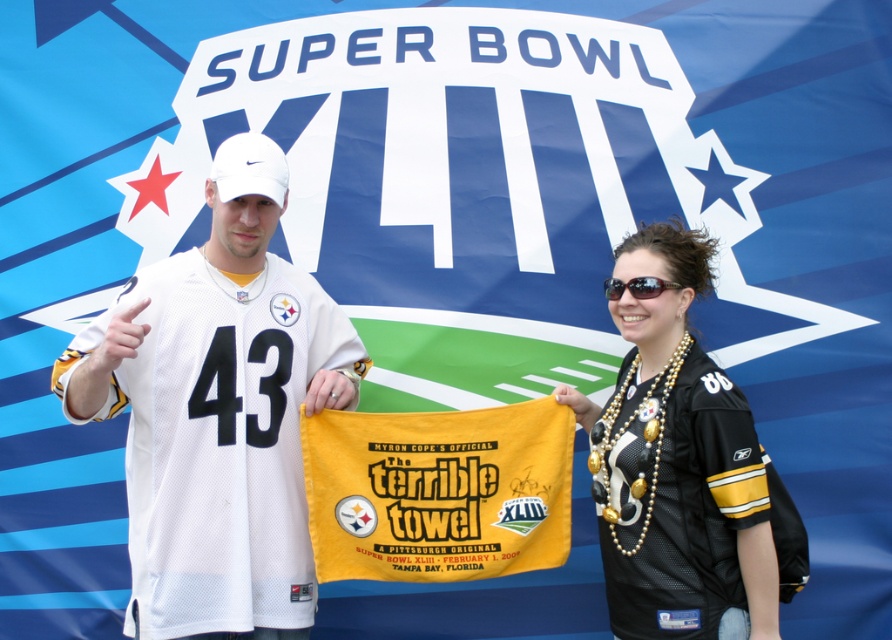
You are standing in front of the Super Bowl XLIII backdrop and see the white jersey at center and the black jersey at center. If you want to place a 3.5 feet wide banner between them, will there be enough space?

The white jersey at center is 3.41 feet away from the black jersey at center. Since the distance between them is less than the 3.5 feet width of the banner, there won not be enough space to place the banner between them.

You are standing in front of the Super Bowl XLIII promotional backdrop. You see a point marked at coordinates [219,412]. What object is located at this point?

The point at coordinates [219,412] indicates the white jersey at center.